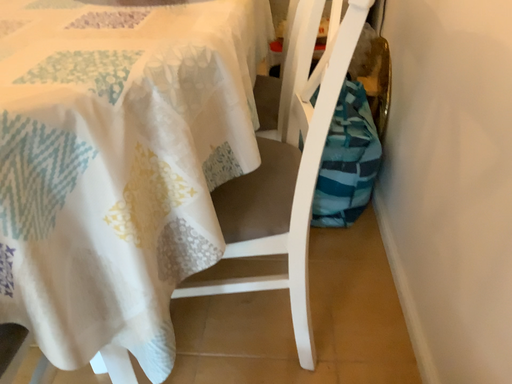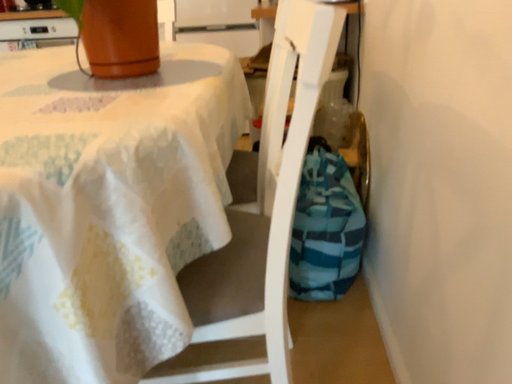
Question: How did the camera likely rotate when shooting the video?

Choices:
 (A) rotated downward
 (B) rotated upward

Answer: (B)